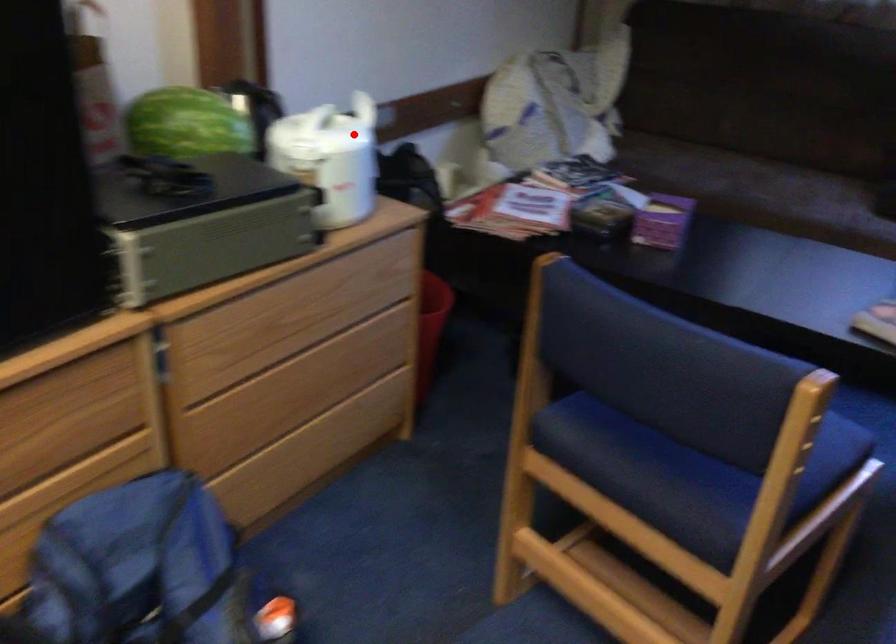
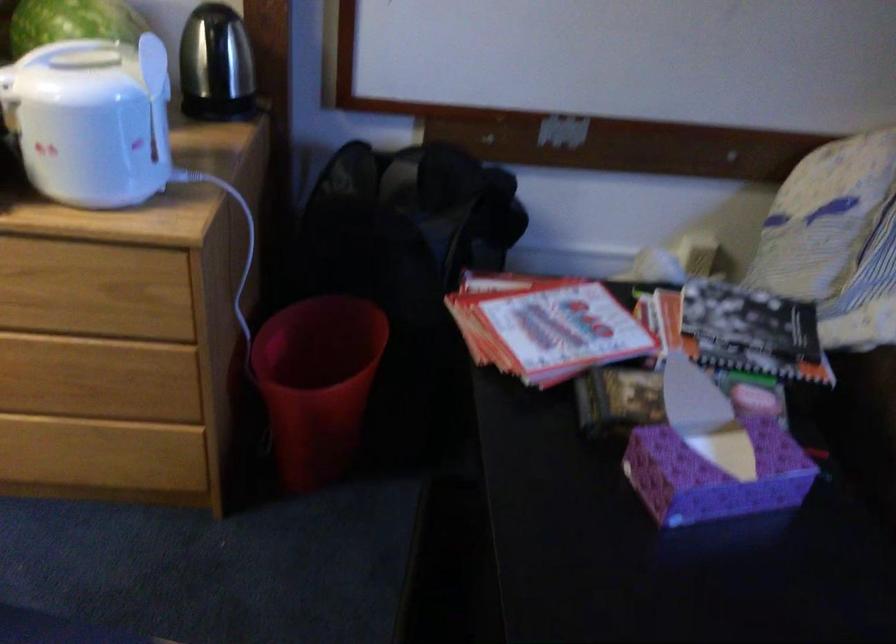
Question: I am providing you with two images of the same scene from different viewpoints. In image1, a red point is highlighted. Considering the same 3D point in image2, which of the following is correct?

Choices:
 (A) It is closer
 (B) It is farther

Answer: (A)